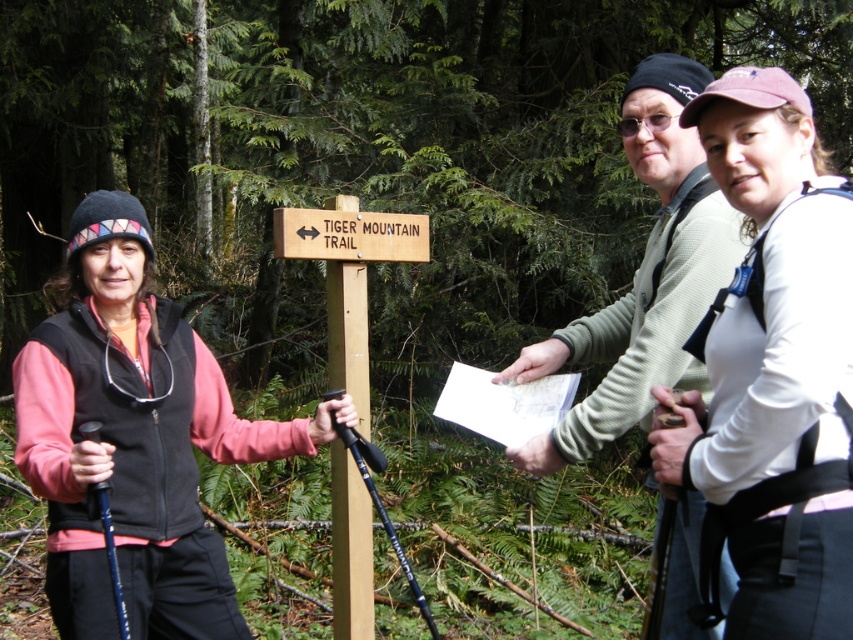
You are a hiker planning to take a photo of the white matte shirt at upper right and the light gray sweater at center. Which of the two should you focus on first if you want to capture both in a single frame without moving the camera?

You should focus on the light gray sweater at center first because the white matte shirt at upper right is located below it, so adjusting focus to the center ensures both are in the frame.

You are a hiker trying to decide whether to place your backpack on the white matte shirt at upper right or the brushed metal hiking poles at left. Which surface would be more stable for placing your backpack?

The brushed metal hiking poles at left are more stable for placing your backpack because the white matte shirt at upper right is positioned over them, meaning the poles are likely lower and more grounded, providing a steadier base.

You are a hiker trying to follow the Tiger Mountain Trail sign. You see two points marked on the map. Which point is closer to the signpost? The points are point (770,550) and point (189,365).

Point (770,550) is in front of point (189,365), so it is closer to the signpost.